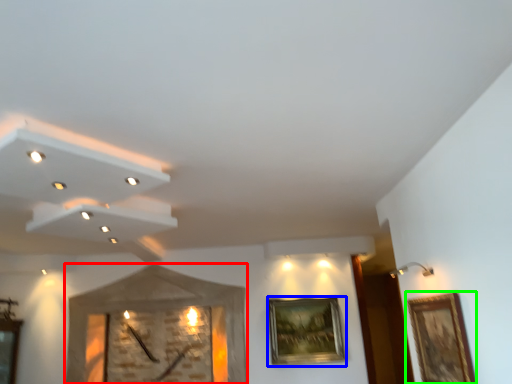
Question: Which is nearer to the clock (highlighted by a red box)? picture frame (highlighted by a blue box) or picture frame (highlighted by a green box).

Choices:
 (A) picture frame
 (B) picture frame

Answer: (A)